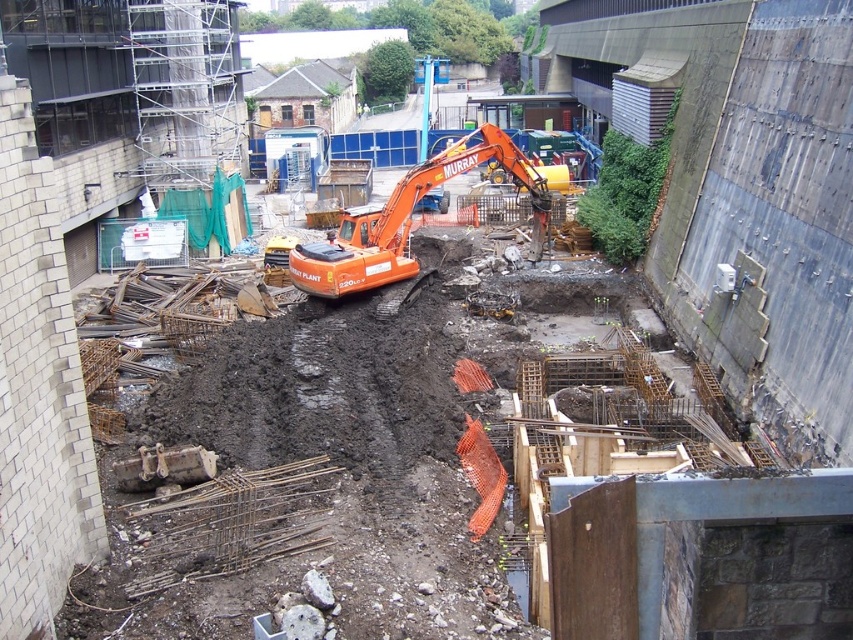
You are a safety inspector at the construction site. You notice an orange rubber excavator at center and an orange hard hat at center. Which object is larger in size?

The orange rubber excavator at center is bigger than the orange hard hat at center according to the description.

You are a construction worker standing at the point labeled point (409, 220). What object are you standing on?

You are standing on the orange rubber excavator at center marked by point (409, 220).